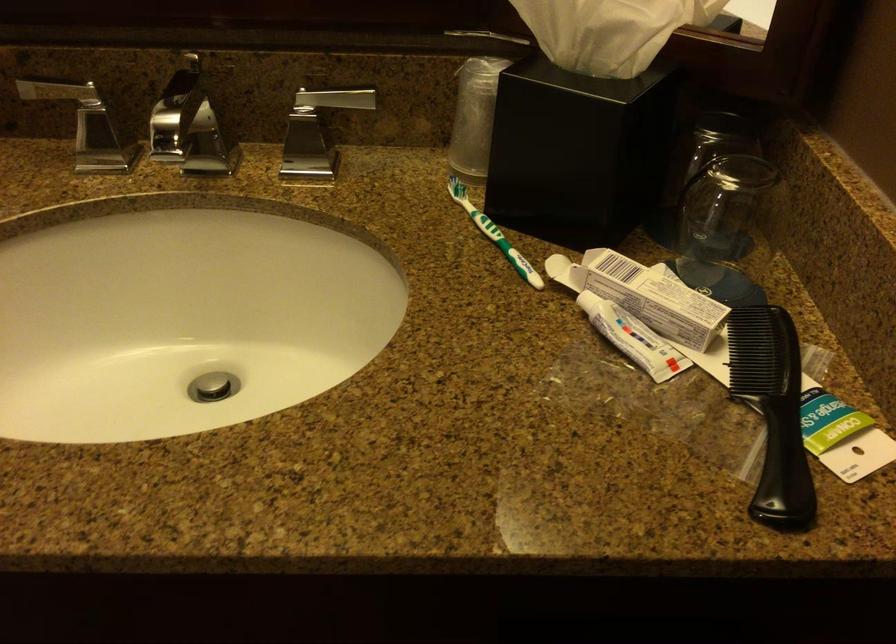
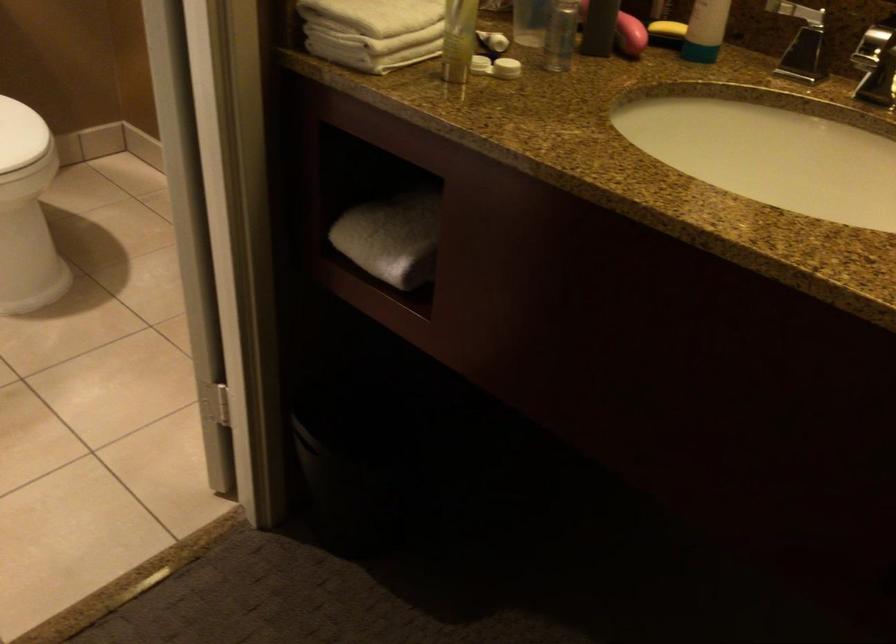
Question: The camera is either moving clockwise (left) or counter-clockwise (right) around the object. The first image is from the beginning of the video and the second image is from the end. Is the camera moving left or right when shooting the video?

Choices:
 (A) Left
 (B) Right

Answer: (B)